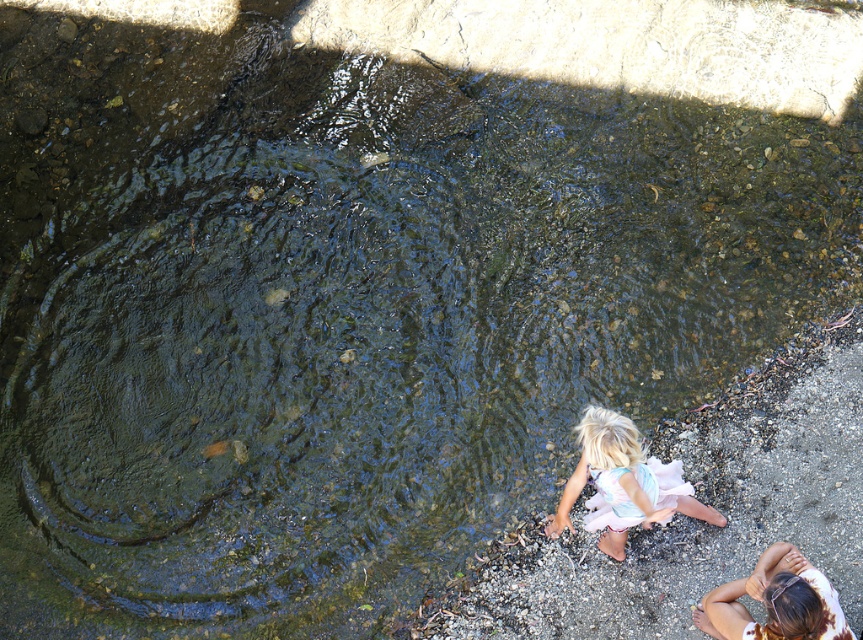
From the picture: You are a photographer trying to capture the child in the scene. Since the pastel floral dress at lower right and the light brown hair at lower right are both visible, which one appears wider in the image?

The pastel floral dress at lower right appears wider than the light brown hair at lower right as its width surpasses the latter.

You are a photographer trying to capture the child in the scene. If you want to focus on the light brown hair at lower right, will it be visible behind the pastel floral dress at lower right?

The light brown hair at lower right is behind the pastel floral dress at lower right, so it might be partially or fully obscured depending on the dress material and positioning.